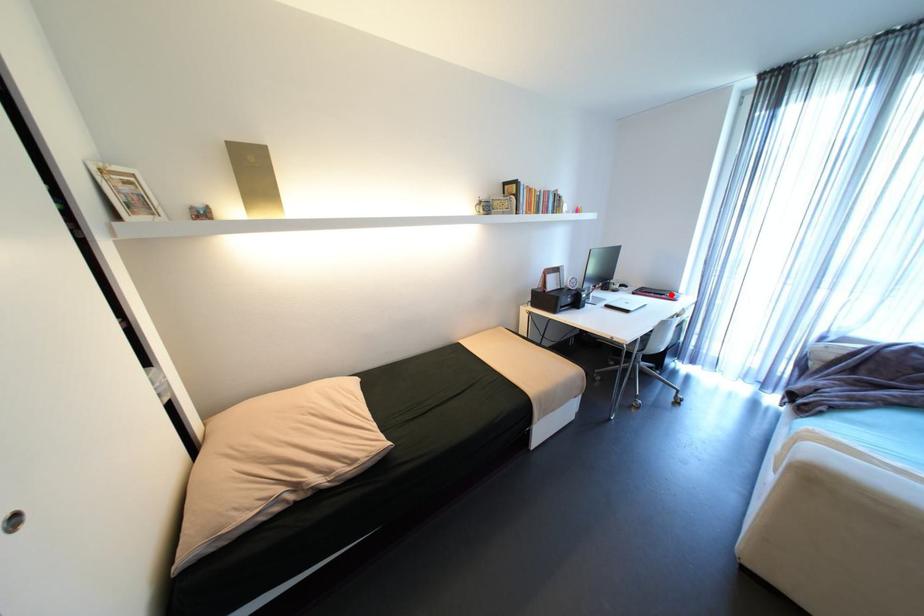
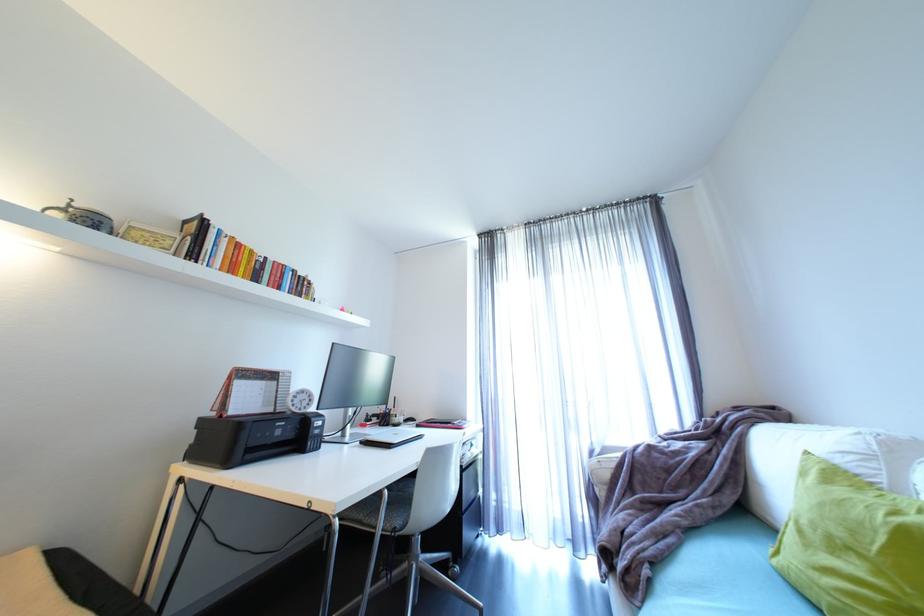
The point at the highlighted location is marked in the first image. Where is the corresponding point in the second image?

(457, 424)